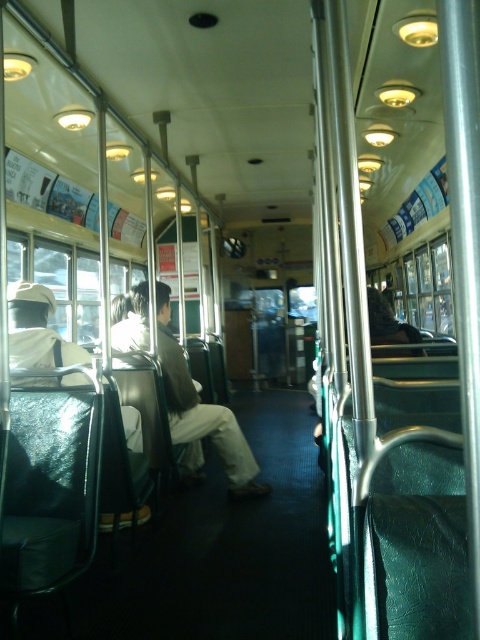
Question: Is light brown fabric pants at center to the right of white matte uniform at left from the viewer's perspective?

Choices:
 (A) yes
 (B) no

Answer: (A)

Question: Where is light brown fabric pants at center located in relation to white matte uniform at left in the image?

Choices:
 (A) left
 (B) right

Answer: (B)

Question: Does light brown fabric pants at center lie in front of white matte uniform at left?

Choices:
 (A) yes
 (B) no

Answer: (B)

Question: Which of the following is the closest to the observer?

Choices:
 (A) (11, 368)
 (B) (172, 381)

Answer: (A)